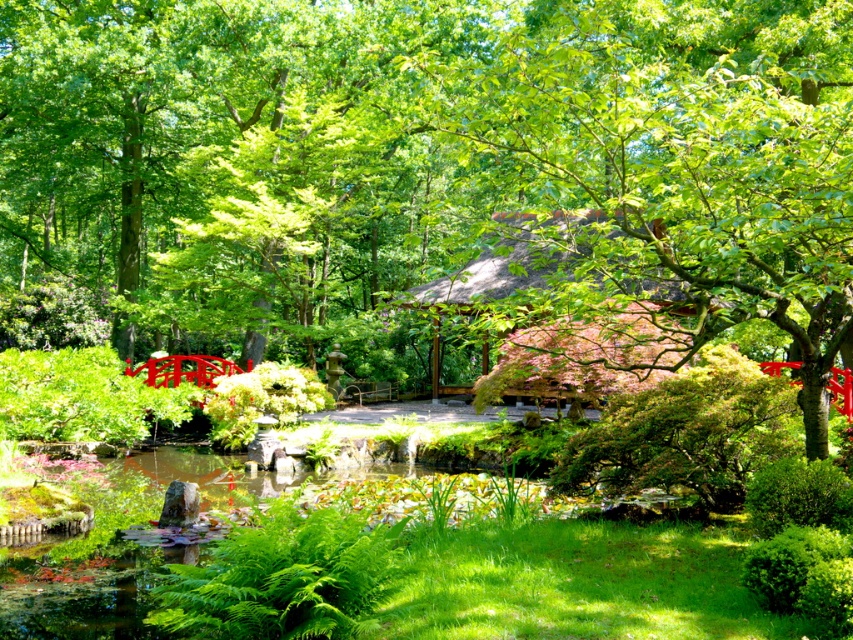
Who is positioned more to the left, green leafy tree at center or green leafy fern at lower center?

From the viewer's perspective, green leafy tree at center appears more on the left side.

Where is `green leafy tree at center`? green leafy tree at center is located at coordinates (427, 173).

Is point (279, 632) closer to camera compared to point (492, 392)?

Yes.

From the picture: Between green leafy fern at lower center and thatched roof hut at center, which one is positioned higher?

thatched roof hut at center

Is point (189, 616) closer to viewer compared to point (521, 339)?

Yes, it is in front of point (521, 339).

You are a GUI agent. You are given a task and a screenshot of the screen. Output one action in this format:
    pyautogui.click(x=<x>, y=<y>)
    Task: Click on the green leafy fern at lower center
    This screenshot has height=640, width=853.
    Given the screenshot: What is the action you would take?
    pyautogui.click(x=281, y=579)

Consider the image. Between green leafy tree at center and thatched roof hut at center, which one is positioned higher?

Positioned higher is green leafy tree at center.

Does green leafy tree at center appear on the left side of thatched roof hut at center?

Indeed, green leafy tree at center is positioned on the left side of thatched roof hut at center.

Describe the element at coordinates (427, 173) in the screenshot. I see `green leafy tree at center` at that location.

At what (x,y) coordinates should I click in order to perform the action: click on green leafy tree at center. Please return your answer as a coordinate pair (x, y). The image size is (853, 640). Looking at the image, I should click on (427, 173).